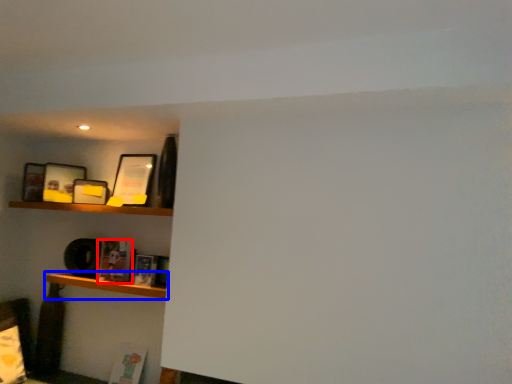
Question: Which object is closer to the camera taking this photo, book (highlighted by a red box) or shelf (highlighted by a blue box)?

Choices:
 (A) book
 (B) shelf

Answer: (B)